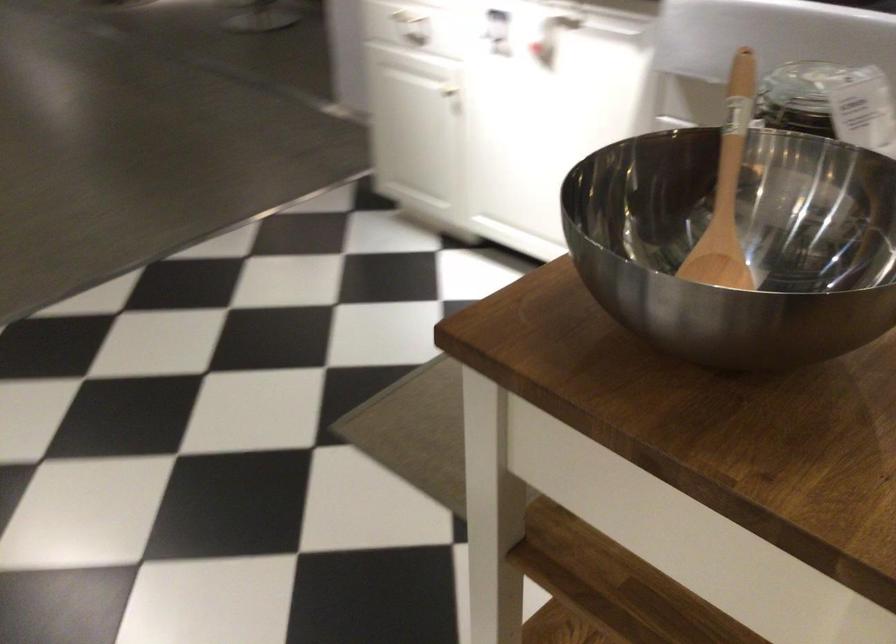
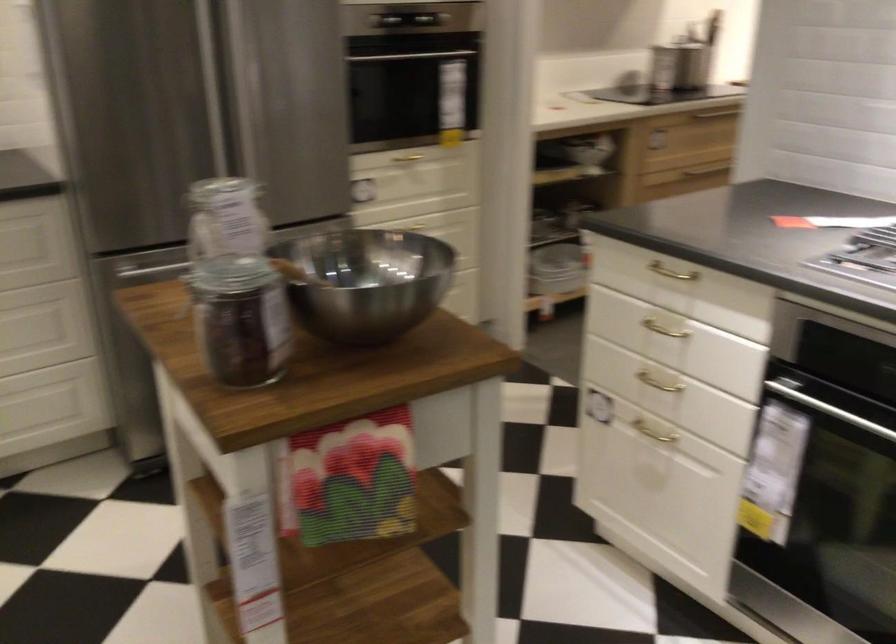
Locate, in the second image, the point that corresponds to (x=718, y=341) in the first image.

(366, 281)